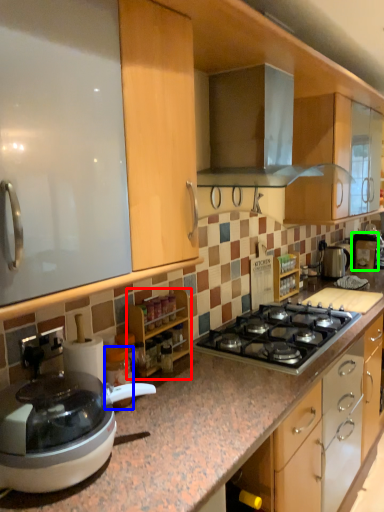
Question: Which object is positioned closest to cabinetry (highlighted by a red box)? Select from appliance (highlighted by a blue box) and coffee machine (highlighted by a green box).

Choices:
 (A) appliance
 (B) coffee machine

Answer: (A)